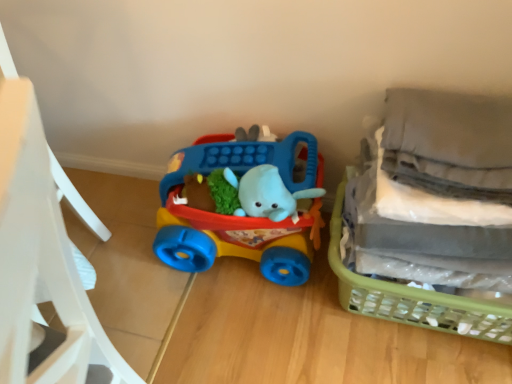
Describe the element at coordinates (413, 298) in the screenshot. I see `green plastic basket at right` at that location.

What do you see at coordinates (40, 254) in the screenshot?
I see `matte plastic chair at left` at bounding box center [40, 254].

Where is `green plastic basket at right`? This screenshot has width=512, height=384. green plastic basket at right is located at coordinates click(x=413, y=298).

Which is more to the right, green plastic basket at right or matte plastic toy car at center?

green plastic basket at right.

Is green plastic basket at right in front of matte plastic toy car at center?

Yes, green plastic basket at right is closer to the camera.

From a real-world perspective, is green plastic basket at right physically located above or below matte plastic toy car at center?

From a real-world perspective, green plastic basket at right is physically below matte plastic toy car at center.

Is green plastic basket at right located outside matte plastic toy car at center?

Yes, green plastic basket at right is outside of matte plastic toy car at center.

Are green plastic basket at right and matte plastic chair at left beside each other?

No, green plastic basket at right is not in contact with matte plastic chair at left.

From the image's perspective, between green plastic basket at right and matte plastic chair at left, which one is located above?

green plastic basket at right is shown above in the image.

From a real-world perspective, which object rests below the other?

green plastic basket at right, from a real-world perspective.

How many degrees apart are the facing directions of green plastic basket at right and matte plastic chair at left?

The angle between the facing direction of green plastic basket at right and the facing direction of matte plastic chair at left is 86.6 degrees.

How different are the orientations of matte plastic toy car at center and matte plastic chair at left in degrees?

86.6 degrees.

Is point (172, 218) in front of point (34, 102)?

That is False.

Find the location of a particular element. The height and width of the screenshot is (384, 512). chair in front of the matte plastic toy car at center is located at coordinates (40, 254).

Would you say matte plastic toy car at center is a long distance from matte plastic chair at left?

matte plastic toy car at center is near matte plastic chair at left, not far away.

Are matte plastic chair at left and matte plastic toy car at center far apart?

No.

Which of these two, matte plastic chair at left or matte plastic toy car at center, is bigger?

With larger size is matte plastic chair at left.

Is the position of matte plastic chair at left less distant than that of matte plastic toy car at center?

Yes, it is in front of matte plastic toy car at center.

Locate an element on the screen. The height and width of the screenshot is (384, 512). toy above the green plastic basket at right (from the image's perspective) is located at coordinates (239, 217).

Could you tell me if matte plastic toy car at center is facing green plastic basket at right?

No, matte plastic toy car at center is not facing towards green plastic basket at right.

Is matte plastic toy car at center next to green plastic basket at right?

No.

Which object is positioned more to the right, matte plastic toy car at center or green plastic basket at right?

green plastic basket at right is more to the right.

How distant is matte plastic chair at left from green plastic basket at right?

matte plastic chair at left is 66.62 centimeters from green plastic basket at right.

Which point is more distant from viewer, (12, 165) or (368, 281)?

The point (368, 281) is farther.

Is matte plastic chair at left next to green plastic basket at right?

No, matte plastic chair at left is not touching green plastic basket at right.

Which is behind, matte plastic chair at left or green plastic basket at right?

green plastic basket at right is more distant.

Locate an element on the screen. toy that is above the green plastic basket at right (from the image's perspective) is located at coordinates (239, 217).

This screenshot has height=384, width=512. Identify the location of chair in front of the green plastic basket at right. (40, 254).

From the image, which object appears to be nearer to green plastic basket at right, matte plastic toy car at center or matte plastic chair at left?

matte plastic toy car at center is closer to green plastic basket at right.

Looking at the image, which one is located further to matte plastic chair at left, green plastic basket at right or matte plastic toy car at center?

green plastic basket at right is positioned further to the anchor matte plastic chair at left.

Based on their spatial positions, is matte plastic toy car at center or green plastic basket at right further from matte plastic chair at left?

The object further to matte plastic chair at left is green plastic basket at right.

Based on the photo, estimate the real-world distances between objects in this image. Which object is closer to matte plastic toy car at center, green plastic basket at right or matte plastic chair at left?

Based on the image, green plastic basket at right appears to be nearer to matte plastic toy car at center.

Estimate the real-world distances between objects in this image. Which object is further from green plastic basket at right, matte plastic chair at left or matte plastic toy car at center?

→ Based on the image, matte plastic chair at left appears to be further to green plastic basket at right.

Looking at the image, which one is located further to matte plastic toy car at center, matte plastic chair at left or green plastic basket at right?

Based on the image, matte plastic chair at left appears to be further to matte plastic toy car at center.

I want to click on toy between matte plastic chair at left and green plastic basket at right in the horizontal direction, so click(239, 217).